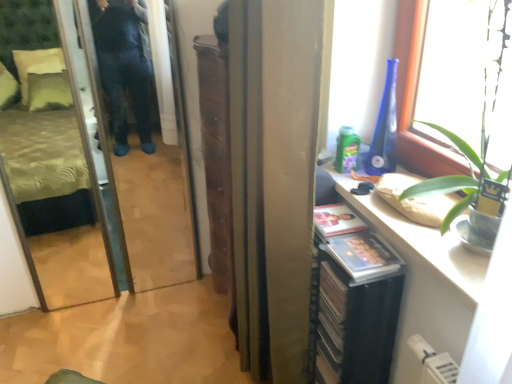
At what (x,y) coordinates should I click in order to perform the action: click on empty space that is to the right of transparent glass screen door at left. Please return your answer as a coordinate pair (x, y). Looking at the image, I should click on (175, 311).